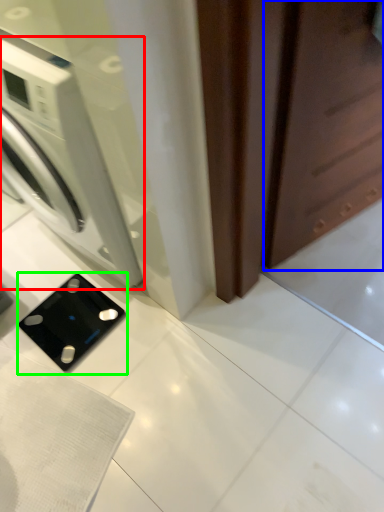
Question: Which is nearer to the washing machine (highlighted by a red box)? screen door (highlighted by a blue box) or appliance (highlighted by a green box).

Choices:
 (A) screen door
 (B) appliance

Answer: (B)